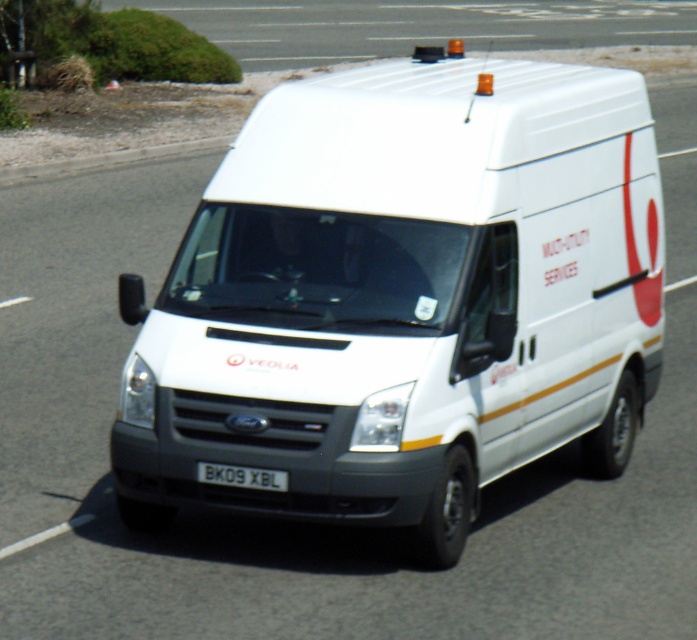
Question: Among these points, which one is nearest to the camera?

Choices:
 (A) (279, 472)
 (B) (398, 120)

Answer: (A)

Question: Which point is farther from the camera taking this photo?

Choices:
 (A) (415, 392)
 (B) (206, 468)

Answer: (B)

Question: Is white matte van at center bigger than black plastic license plate at center?

Choices:
 (A) yes
 (B) no

Answer: (A)

Question: Is white matte van at center thinner than black plastic license plate at center?

Choices:
 (A) no
 (B) yes

Answer: (A)

Question: Is white matte van at center bigger than black plastic license plate at center?

Choices:
 (A) yes
 (B) no

Answer: (A)